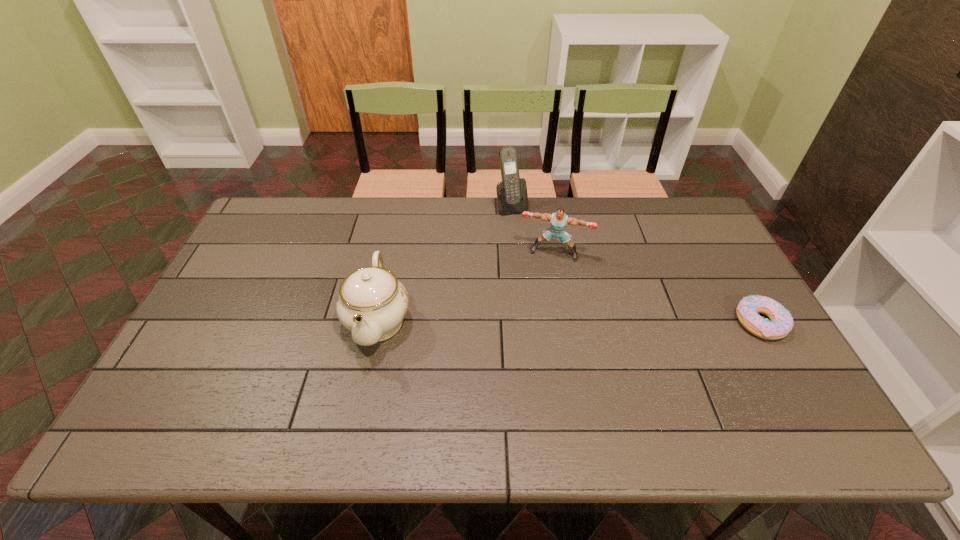
Locate which object ranks in proximity to the leftmost object. Please provide its 2D coordinates. Your answer should be formatted as a tuple, i.e. [(x, y)], where the tuple contains the x and y coordinates of a point satisfying the conditions above.

[(559, 220)]

Point out which object is positioned as the third nearest to the shortest object. Please provide its 2D coordinates. Your answer should be formatted as a tuple, i.e. [(x, y)], where the tuple contains the x and y coordinates of a point satisfying the conditions above.

[(372, 303)]

This screenshot has width=960, height=540. Identify the location of blank area in the image that satisfies the following two spatial constraints: 1. on the front side of the puncher; 2. on the right side of the cellular telephone. (516, 253).

This screenshot has height=540, width=960. Identify the location of vacant area in the image that satisfies the following two spatial constraints: 1. at the spout of the doughnut; 2. on the right side of the chinaware. (377, 322).

Find the location of a particular element. The width and height of the screenshot is (960, 540). vacant space that satisfies the following two spatial constraints: 1. on the front side of the second farthest object; 2. on the left side of the farthest object is located at coordinates (516, 253).

The width and height of the screenshot is (960, 540). Find the location of `vacant space that satisfies the following two spatial constraints: 1. on the front side of the rightmost object; 2. on the right side of the second farthest object`. vacant space that satisfies the following two spatial constraints: 1. on the front side of the rightmost object; 2. on the right side of the second farthest object is located at coordinates (566, 322).

Where is `free space that satisfies the following two spatial constraints: 1. at the spout of the rightmost object; 2. on the right side of the leftmost object`? Image resolution: width=960 pixels, height=540 pixels. free space that satisfies the following two spatial constraints: 1. at the spout of the rightmost object; 2. on the right side of the leftmost object is located at coordinates (377, 322).